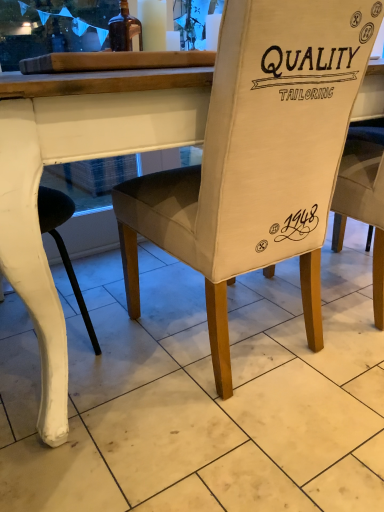
The height and width of the screenshot is (512, 384). Find the location of `brown glass bottle at upper left`. brown glass bottle at upper left is located at coordinates (124, 30).

What is the approximate width of brown glass bottle at upper left?

brown glass bottle at upper left is 11.34 centimeters in width.

What do you see at coordinates (124, 30) in the screenshot? This screenshot has width=384, height=512. I see `brown glass bottle at upper left` at bounding box center [124, 30].

The image size is (384, 512). Describe the element at coordinates (258, 157) in the screenshot. I see `beige fabric chair at center` at that location.

You are a GUI agent. You are given a task and a screenshot of the screen. Output one action in this format:
    pyautogui.click(x=<x>, y=<y>)
    Task: Click on the beige fabric chair at center
    The height and width of the screenshot is (512, 384).
    Given the screenshot: What is the action you would take?
    pyautogui.click(x=258, y=157)

Locate an element on the screen. The width and height of the screenshot is (384, 512). brown glass bottle at upper left is located at coordinates point(124,30).

In the scene shown: Considering the positions of objects brown glass bottle at upper left and beige fabric chair at center in the image provided, who is more to the right, brown glass bottle at upper left or beige fabric chair at center?

From the viewer's perspective, beige fabric chair at center appears more on the right side.

Considering the relative positions of brown glass bottle at upper left and beige fabric chair at center in the image provided, is brown glass bottle at upper left in front of beige fabric chair at center?

That is False.

Is point (112, 42) more distant than point (251, 176)?

Yes, point (112, 42) is farther from viewer.

From the image's perspective, would you say brown glass bottle at upper left is positioned over beige fabric chair at center?

Yes, from the image's perspective, brown glass bottle at upper left is above beige fabric chair at center.

From a real-world perspective, is brown glass bottle at upper left positioned under beige fabric chair at center based on gravity?

No.

Is brown glass bottle at upper left thinner than beige fabric chair at center?

Correct, the width of brown glass bottle at upper left is less than that of beige fabric chair at center.

Considering the relative sizes of brown glass bottle at upper left and beige fabric chair at center in the image provided, is brown glass bottle at upper left taller than beige fabric chair at center?

Incorrect, the height of brown glass bottle at upper left is not larger of that of beige fabric chair at center.

Does brown glass bottle at upper left have a smaller size compared to beige fabric chair at center?

Yes.

Does brown glass bottle at upper left contain beige fabric chair at center?

No, beige fabric chair at center is not surrounded by brown glass bottle at upper left.

Consider the image. Are brown glass bottle at upper left and beige fabric chair at center beside each other?

There is a gap between brown glass bottle at upper left and beige fabric chair at center.

Is brown glass bottle at upper left facing away from beige fabric chair at center?

No, brown glass bottle at upper left is not facing away from beige fabric chair at center.

Measure the distance between brown glass bottle at upper left and beige fabric chair at center.

The distance of brown glass bottle at upper left from beige fabric chair at center is 29.75 inches.

This screenshot has height=512, width=384. Find the location of `bottle above the beige fabric chair at center (from the image's perspective)`. bottle above the beige fabric chair at center (from the image's perspective) is located at coordinates (124, 30).

Considering the relative positions of beige fabric chair at center and brown glass bottle at upper left in the image provided, is beige fabric chair at center to the right of brown glass bottle at upper left from the viewer's perspective?

Yes, beige fabric chair at center is to the right of brown glass bottle at upper left.

In the scene shown: Is beige fabric chair at center in front of or behind brown glass bottle at upper left in the image?

beige fabric chair at center is positioned closer to the viewer than brown glass bottle at upper left.

Is point (229, 60) farther from viewer compared to point (136, 32)?

No, (229, 60) is closer to viewer.

From the image's perspective, is beige fabric chair at center on brown glass bottle at upper left?

No.

From a real-world perspective, between beige fabric chair at center and brown glass bottle at upper left, who is vertically lower?

beige fabric chair at center.

Considering the relative sizes of beige fabric chair at center and brown glass bottle at upper left in the image provided, is beige fabric chair at center wider than brown glass bottle at upper left?

Yes.

In terms of height, does beige fabric chair at center look taller or shorter compared to brown glass bottle at upper left?

Considering their sizes, beige fabric chair at center has more height than brown glass bottle at upper left.

Is beige fabric chair at center bigger than brown glass bottle at upper left?

Yes, beige fabric chair at center is bigger than brown glass bottle at upper left.

Would you say brown glass bottle at upper left is part of beige fabric chair at center's contents?

No.

Is there a large distance between beige fabric chair at center and brown glass bottle at upper left?

No.

Is beige fabric chair at center facing towards brown glass bottle at upper left?

Yes.

In the scene shown: How different are the orientations of beige fabric chair at center and brown glass bottle at upper left in degrees?

There is a 180-degree angle between the facing directions of beige fabric chair at center and brown glass bottle at upper left.

Locate an element on the screen. This screenshot has width=384, height=512. chair on the right of brown glass bottle at upper left is located at coordinates (258, 157).

I want to click on chair below the brown glass bottle at upper left (from the image's perspective), so click(258, 157).

The height and width of the screenshot is (512, 384). Identify the location of bottle behind the beige fabric chair at center. (124, 30).